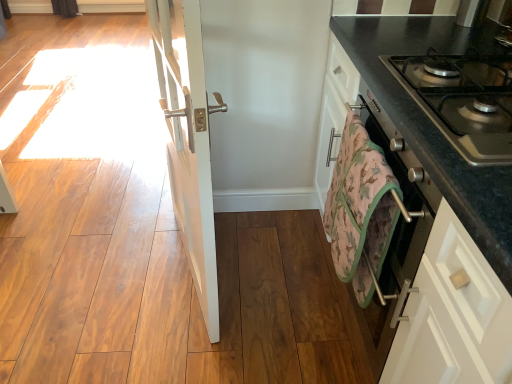
This screenshot has width=512, height=384. Identify the location of free space to the right of white glossy door at center. (276, 279).